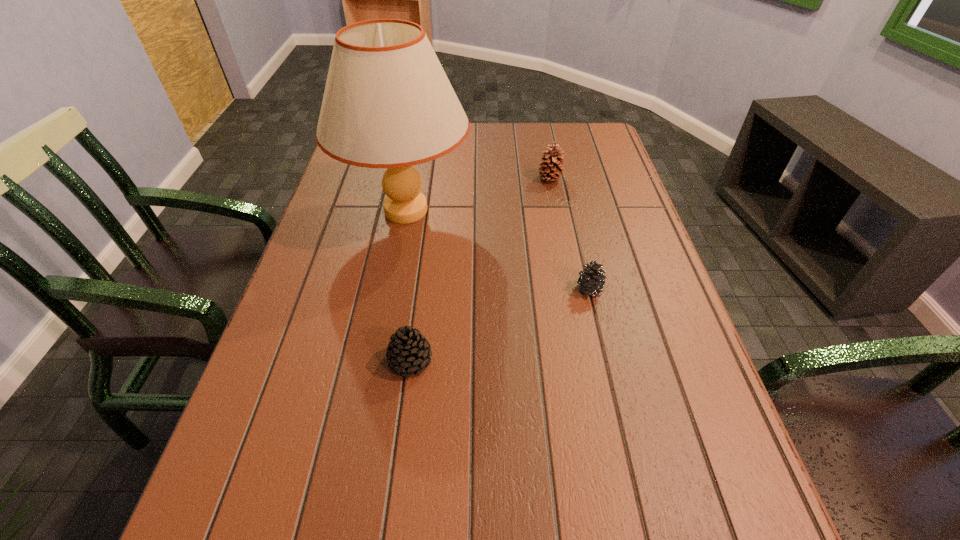
You are a GUI agent. You are given a task and a screenshot of the screen. Output one action in this format:
    pyautogui.click(x=<x>, y=<y>)
    Task: Click on the tallest object
    Image resolution: width=960 pixels, height=540 pixels.
    Given the screenshot: What is the action you would take?
    pyautogui.click(x=388, y=103)

Identify the location of the second tallest object. This screenshot has height=540, width=960. (552, 168).

The height and width of the screenshot is (540, 960). In order to click on the tallest pinecone in this screenshot , I will do `click(552, 168)`.

Image resolution: width=960 pixels, height=540 pixels. I want to click on the nearest object, so click(x=409, y=351).

Identify the location of the leftmost pinecone. (409, 351).

Locate an element on the screen. the shortest pinecone is located at coordinates (591, 280).

Locate an element on the screen. The width and height of the screenshot is (960, 540). the shortest object is located at coordinates (591, 280).

I want to click on blank space located on the back of the tallest object, so click(418, 148).

The height and width of the screenshot is (540, 960). I want to click on vacant point located 0.200m on the front of the tallest pinecone, so click(x=561, y=232).

Locate an element on the screen. free space located 0.170m at the narrow end of the leftmost pinecone is located at coordinates (396, 474).